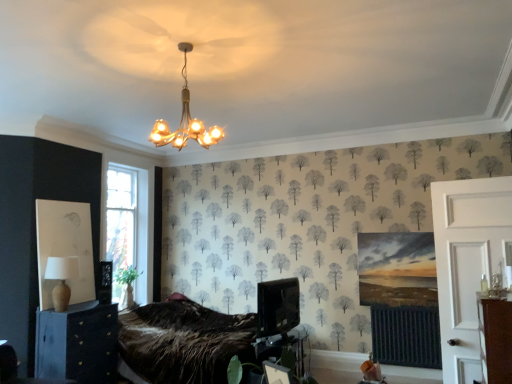
Question: Does matte black cabinet at lower left come behind gold metallic chandelier at upper center?

Choices:
 (A) no
 (B) yes

Answer: (B)

Question: Does matte black cabinet at lower left turn towards gold metallic chandelier at upper center?

Choices:
 (A) no
 (B) yes

Answer: (A)

Question: From a real-world perspective, does matte black cabinet at lower left sit lower than gold metallic chandelier at upper center?

Choices:
 (A) yes
 (B) no

Answer: (A)

Question: Can you confirm if matte black cabinet at lower left is positioned to the left of gold metallic chandelier at upper center?

Choices:
 (A) yes
 (B) no

Answer: (A)

Question: Is matte black cabinet at lower left to the right of gold metallic chandelier at upper center from the viewer's perspective?

Choices:
 (A) yes
 (B) no

Answer: (B)

Question: Is matte black cabinet at lower left wider than gold metallic chandelier at upper center?

Choices:
 (A) no
 (B) yes

Answer: (A)

Question: Is white wooden door at right further to camera compared to beige fabric lampshade at lower left?

Choices:
 (A) no
 (B) yes

Answer: (A)

Question: From the image's perspective, is white wooden door at right below beige fabric lampshade at lower left?

Choices:
 (A) yes
 (B) no

Answer: (B)

Question: From the image's perspective, is white wooden door at right on beige fabric lampshade at lower left?

Choices:
 (A) no
 (B) yes

Answer: (B)

Question: Can you confirm if white wooden door at right is positioned to the right of beige fabric lampshade at lower left?

Choices:
 (A) yes
 (B) no

Answer: (A)

Question: Is white wooden door at right facing away from beige fabric lampshade at lower left?

Choices:
 (A) no
 (B) yes

Answer: (A)

Question: Is white wooden door at right not within beige fabric lampshade at lower left?

Choices:
 (A) yes
 (B) no

Answer: (A)

Question: Is matte black cabinet at lower left facing towards white wooden door at right?

Choices:
 (A) yes
 (B) no

Answer: (A)